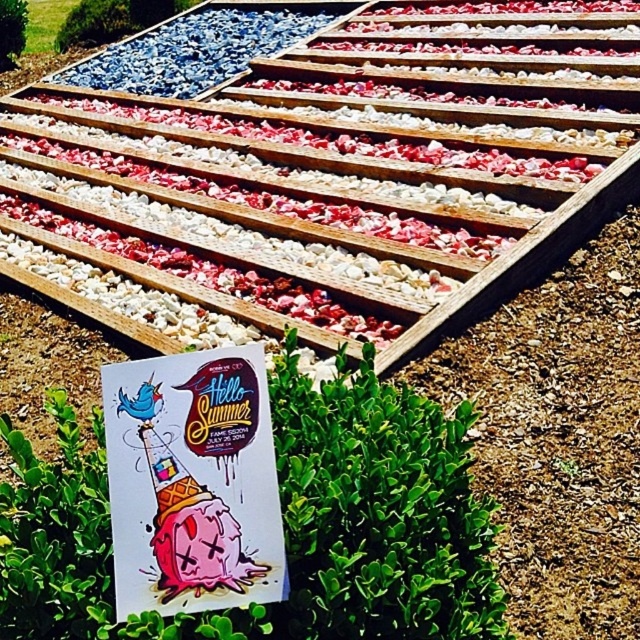
Does green leafy bush at center have a smaller size compared to green leafy bush at upper left?

Yes.

In the scene shown: Who is more distant from viewer, (x=99, y=616) or (x=6, y=60)?

The point (x=6, y=60) is more distant.

Consider the image. Who is more distant from viewer, [90,609] or [24,44]?

The point [24,44] is behind.

At what (x,y) coordinates should I click in order to perform the action: click on green leafy bush at center. Please return your answer as a coordinate pair (x, y). The image size is (640, 640). Looking at the image, I should click on (284, 524).